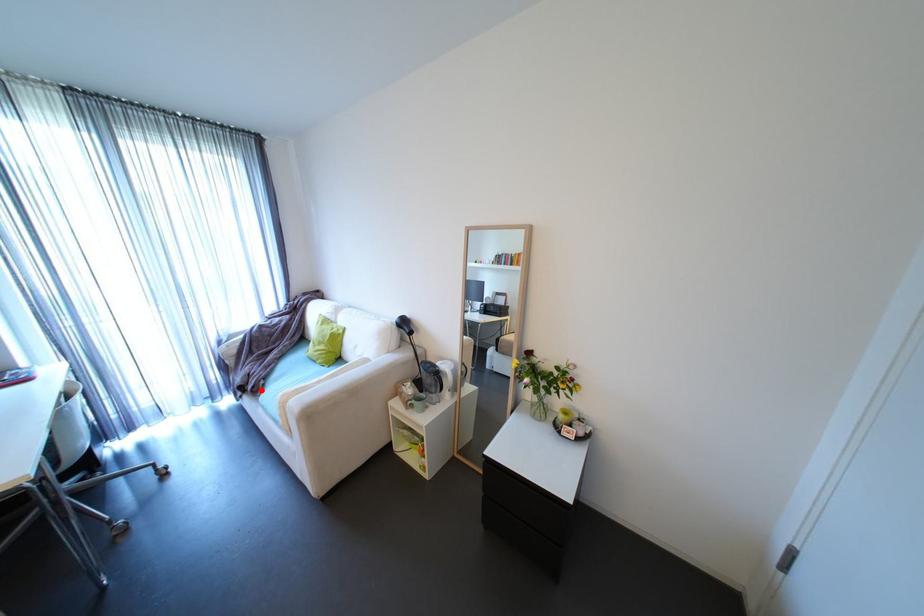
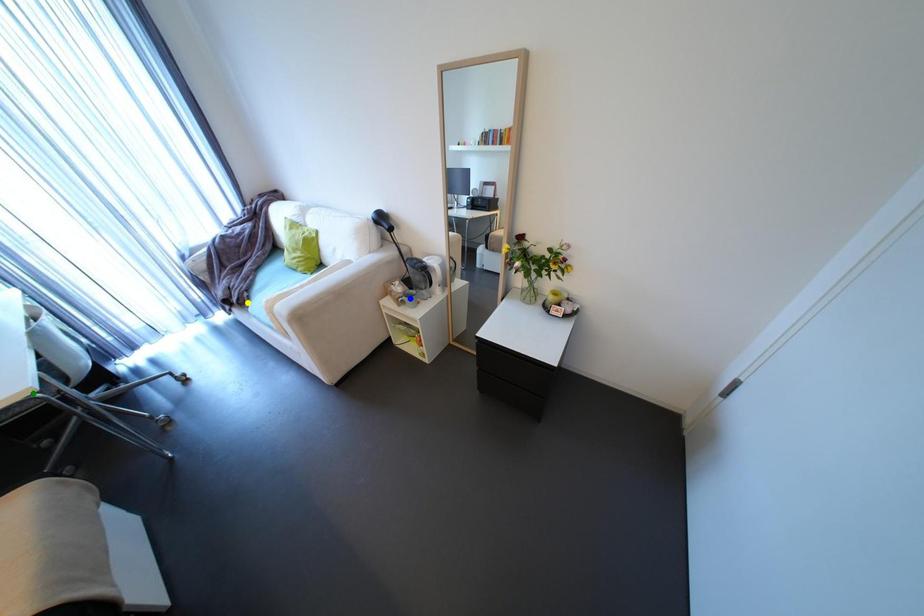
Question: I am providing you with two images of the same scene from different viewpoints. A red point is marked on the first image. You are given multiple points on the second image. Can you choose the point in image 2 that corresponds to the point in image 1?

Choices:
 (A) green point
 (B) blue point
 (C) yellow point

Answer: (C)